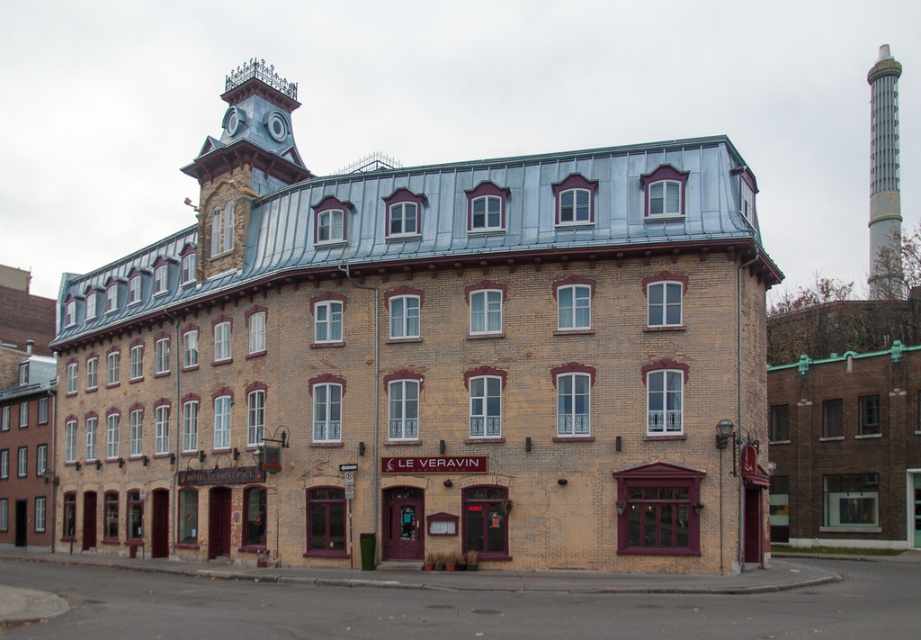
This screenshot has width=921, height=640. Find the location of `blue stone clock tower at upper left`. blue stone clock tower at upper left is located at coordinates (243, 161).

The image size is (921, 640). Identify the location of blue stone clock tower at upper left. (243, 161).